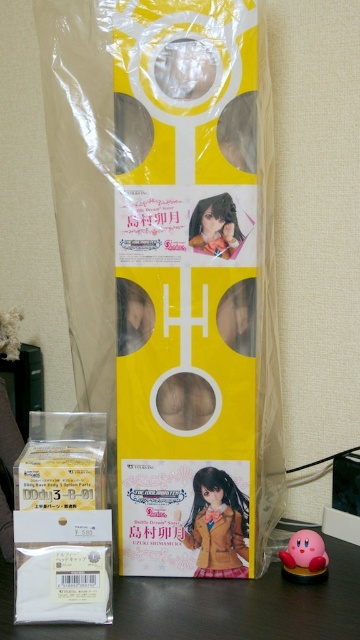
Question: Based on their relative distances, which object is farther from the matte brown doll at center?

Choices:
 (A) yellow matte paper bag at center
 (B) pink rubber kirby at lower right
 (C) white matte paper at lower center

Answer: (A)

Question: Can you confirm if yellow matte paper bag at center is thinner than white matte paper at lower center?

Choices:
 (A) no
 (B) yes

Answer: (B)

Question: Based on their relative distances, which object is nearer to the yellow matte paper bag at center?

Choices:
 (A) white matte paper at lower center
 (B) pink rubber kirby at lower right

Answer: (A)

Question: Does yellow matte paper bag at center appear on the right side of white matte paper at lower center?

Choices:
 (A) yes
 (B) no

Answer: (B)

Question: Which of the following is the farthest from the observer?

Choices:
 (A) (223, 476)
 (B) (313, 557)
 (C) (244, 198)
 (D) (223, 628)

Answer: (A)

Question: Is white matte paper at lower center wider than pink rubber kirby at lower right?

Choices:
 (A) no
 (B) yes

Answer: (B)